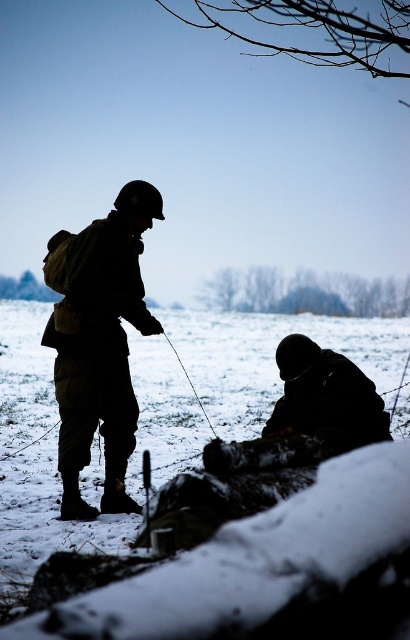
Which is more to the left, white powdery snow at lower center or dark matte uniform at lower right?

From the viewer's perspective, white powdery snow at lower center appears more on the left side.

Image resolution: width=410 pixels, height=640 pixels. What do you see at coordinates (266, 568) in the screenshot?
I see `white powdery snow at lower center` at bounding box center [266, 568].

Is point (18, 518) positioned behind point (380, 426)?

Yes.

Identify the location of white powdery snow at lower center. (266, 568).

Is white powdery snow at lower center to the right of black matte uniform at center from the viewer's perspective?

Yes, white powdery snow at lower center is to the right of black matte uniform at center.

Can you confirm if white powdery snow at lower center is positioned below black matte uniform at center?

Yes, white powdery snow at lower center is below black matte uniform at center.

This screenshot has width=410, height=640. Find the location of `white powdery snow at lower center`. white powdery snow at lower center is located at coordinates (266, 568).

Which is more to the right, black matte uniform at center or dark matte uniform at lower right?

dark matte uniform at lower right is more to the right.

Where is `black matte uniform at center`? black matte uniform at center is located at coordinates (100, 346).

Locate an element on the screen. Image resolution: width=410 pixels, height=640 pixels. black matte uniform at center is located at coordinates (100, 346).

What are the coordinates of `black matte uniform at center` in the screenshot? It's located at (100, 346).